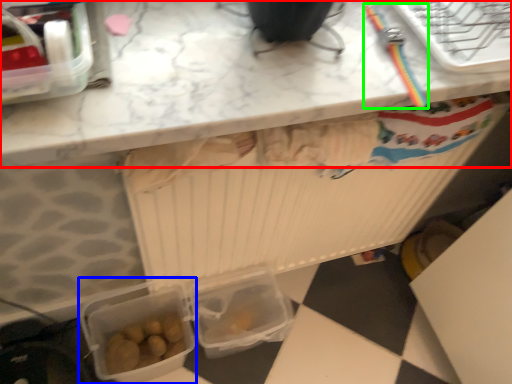
Question: Considering the real-world distances, which object is farthest from countertop (highlighted by a red box)? lunch box (highlighted by a blue box) or tool (highlighted by a green box)?

Choices:
 (A) lunch box
 (B) tool

Answer: (A)